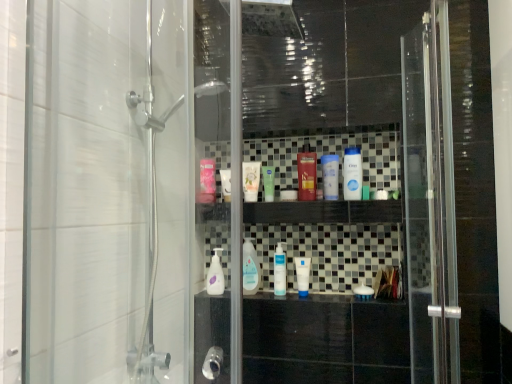
Question: Which direction should I rotate to look at white glossy mouthwash at upper center, acting as the seventh mouthwash starting from the left?

Choices:
 (A) left
 (B) right

Answer: (B)

Question: Which direction should I rotate to look at white matte tube at center, the 1th toiletry ordered from the bottom?

Choices:
 (A) right
 (B) left

Answer: (A)

Question: Is pink glossy mouthwash at center, acting as the seventh mouthwash starting from the right, touching clear plastic mouthwash at center, acting as the 6th mouthwash starting from the right?

Choices:
 (A) yes
 (B) no

Answer: (B)

Question: Is pink glossy mouthwash at center, marked as the first mouthwash in a left-to-right arrangement, facing away from clear plastic mouthwash at center, the 2th mouthwash from the left?

Choices:
 (A) yes
 (B) no

Answer: (B)

Question: Can you confirm if pink glossy mouthwash at center, marked as the first mouthwash in a left-to-right arrangement, is taller than clear plastic mouthwash at center, acting as the 6th mouthwash starting from the right?

Choices:
 (A) yes
 (B) no

Answer: (B)

Question: Does pink glossy mouthwash at center, marked as the first mouthwash in a left-to-right arrangement, lie in front of clear plastic mouthwash at center, the 2th mouthwash from the left?

Choices:
 (A) yes
 (B) no

Answer: (B)

Question: From the image's perspective, is pink glossy mouthwash at center, acting as the seventh mouthwash starting from the right, located beneath clear plastic mouthwash at center, acting as the 6th mouthwash starting from the right?

Choices:
 (A) no
 (B) yes

Answer: (A)

Question: Can you confirm if pink glossy mouthwash at center, marked as the first mouthwash in a left-to-right arrangement, is smaller than clear plastic mouthwash at center, the 2th mouthwash from the left?

Choices:
 (A) yes
 (B) no

Answer: (A)

Question: Is green matte tube at center, placed as the third mouthwash when sorted from left to right, not near white glossy mouthwash at center, which appears as the fourth mouthwash when viewed from the right?

Choices:
 (A) no
 (B) yes

Answer: (A)

Question: From a real-world perspective, is green matte tube at center, placed as the third mouthwash when sorted from left to right, positioned over white glossy mouthwash at center, which appears as the fourth mouthwash when viewed from the right, based on gravity?

Choices:
 (A) no
 (B) yes

Answer: (B)

Question: Is green matte tube at center, placed as the third mouthwash when sorted from left to right, positioned behind white glossy mouthwash at center, marked as the 4th mouthwash in a left-to-right arrangement?

Choices:
 (A) no
 (B) yes

Answer: (B)

Question: Is green matte tube at center, the fifth mouthwash when ordered from right to left, positioned in front of white glossy mouthwash at center, which appears as the fourth mouthwash when viewed from the right?

Choices:
 (A) no
 (B) yes

Answer: (A)

Question: Does green matte tube at center, placed as the third mouthwash when sorted from left to right, have a larger size compared to white glossy mouthwash at center, marked as the 4th mouthwash in a left-to-right arrangement?

Choices:
 (A) no
 (B) yes

Answer: (A)

Question: Is green matte tube at center, the fifth mouthwash when ordered from right to left, outside white glossy mouthwash at center, which appears as the fourth mouthwash when viewed from the right?

Choices:
 (A) no
 (B) yes

Answer: (B)

Question: Considering the relative sizes of white matte tube at center, the 1th toiletry ordered from the bottom, and pink glossy mouthwash at center, marked as the first mouthwash in a left-to-right arrangement, in the image provided, is white matte tube at center, the 1th toiletry ordered from the bottom, shorter than pink glossy mouthwash at center, marked as the first mouthwash in a left-to-right arrangement,?

Choices:
 (A) yes
 (B) no

Answer: (A)